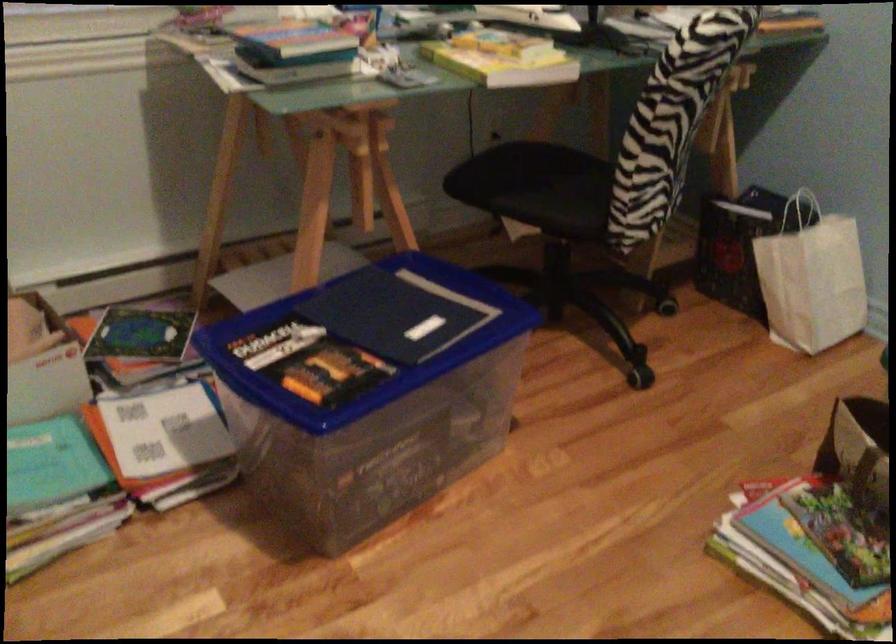
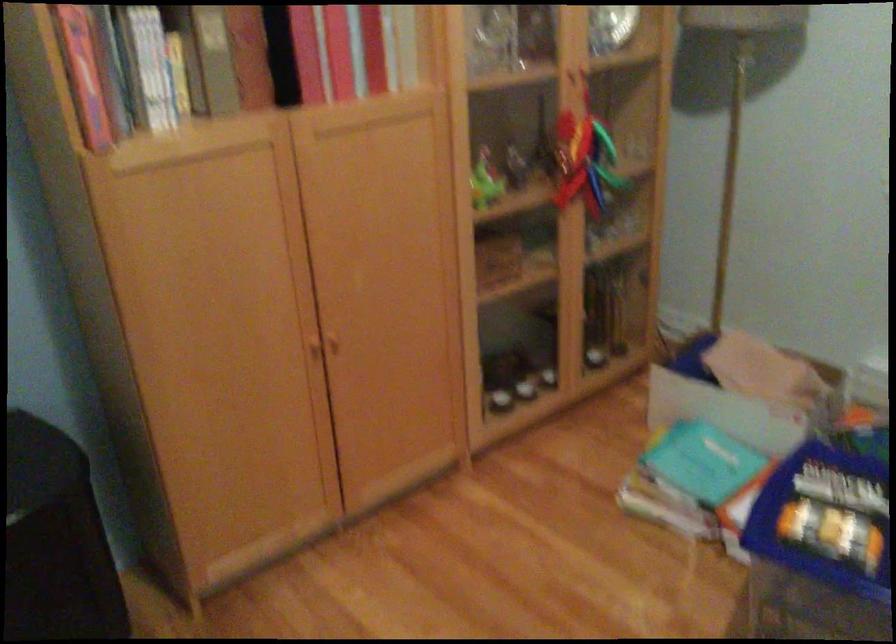
From the picture: The first image is from the beginning of the video and the second image is from the end. How did the camera likely rotate when shooting the video?

The rotation direction of the camera is left-down.